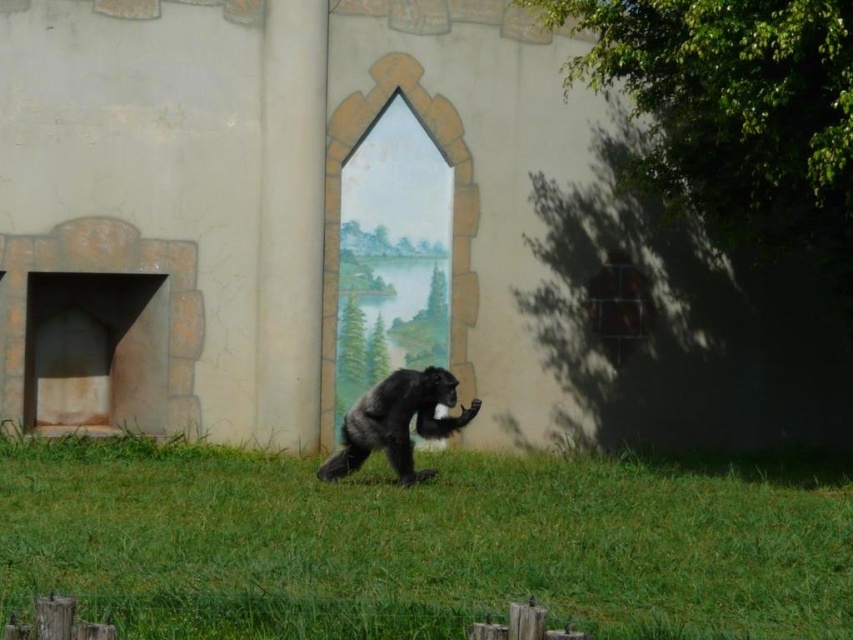
Question: Which object appears closest to the camera in this image?

Choices:
 (A) shiny black ape at center
 (B) green grass at center

Answer: (B)

Question: Can you confirm if green grass at center is positioned to the right of shiny black ape at center?

Choices:
 (A) yes
 (B) no

Answer: (A)

Question: Which of the following is the farthest from the observer?

Choices:
 (A) shiny black ape at center
 (B) green grass at center

Answer: (A)

Question: Is green grass at center wider than shiny black ape at center?

Choices:
 (A) no
 (B) yes

Answer: (A)

Question: Is green grass at center below shiny black ape at center?

Choices:
 (A) no
 (B) yes

Answer: (B)

Question: Which of the following is the closest to the observer?

Choices:
 (A) (607, 576)
 (B) (430, 385)

Answer: (A)